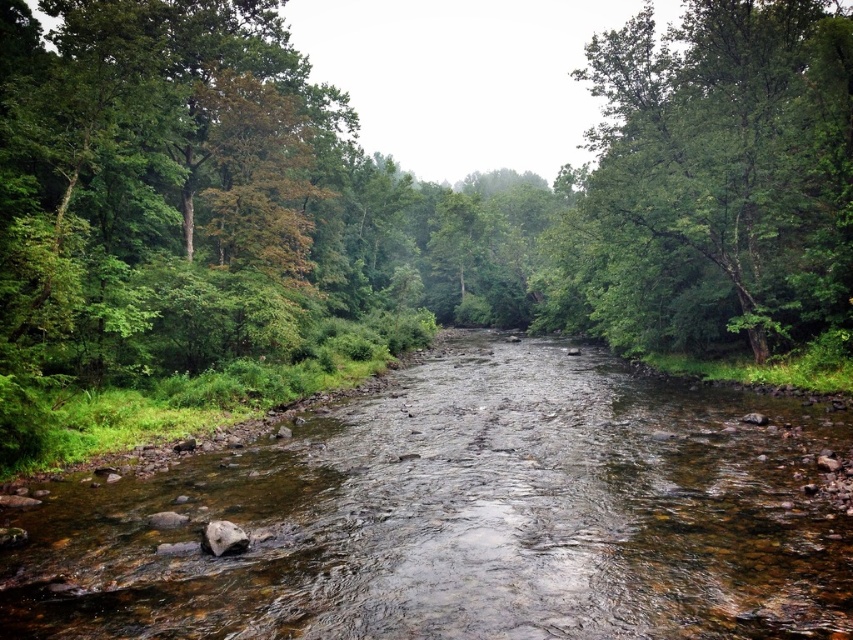
Is point (776, 588) behind point (815, 164)?

No, (776, 588) is closer to viewer.

Does clear water at center have a lesser width compared to green leafy tree at right?

Yes.

Find the location of `clear water at center`. clear water at center is located at coordinates (463, 516).

Locate an element on the screen. The image size is (853, 640). clear water at center is located at coordinates (463, 516).

Between green leafy forest at center and clear water at center, which one has less height?

clear water at center

Does green leafy forest at center have a smaller size compared to clear water at center?

No.

Which is behind, point (630, 234) or point (590, 570)?

The point (630, 234) is more distant.

The height and width of the screenshot is (640, 853). In order to click on green leafy forest at center in this screenshot , I will do `click(399, 205)`.

Which is behind, point (554, 221) or point (695, 218)?

Point (554, 221)

Where is `green leafy forest at center`? green leafy forest at center is located at coordinates (399, 205).